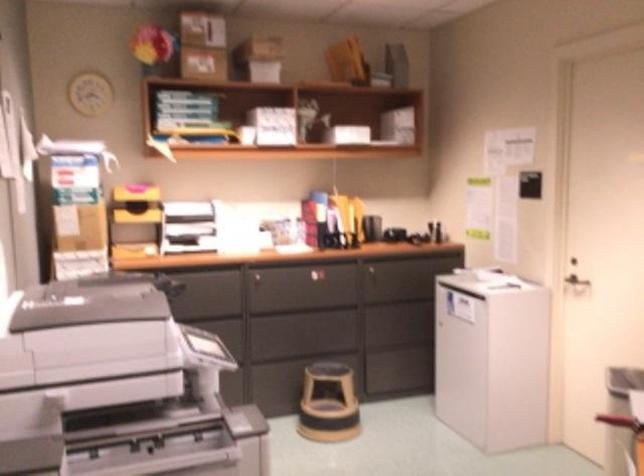
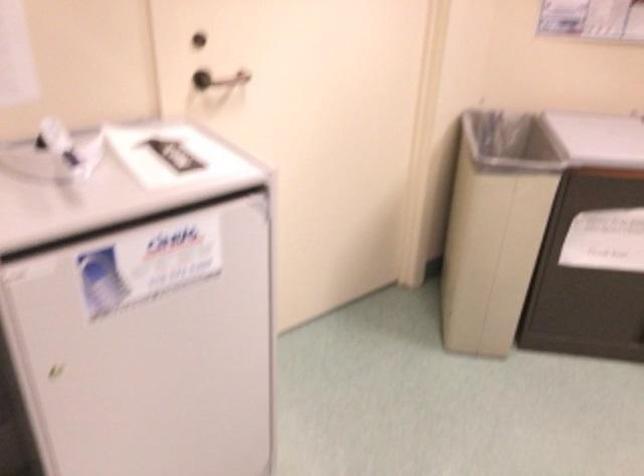
Where in the second image is the point corresponding to the point at 458,335 from the first image?

(146, 343)